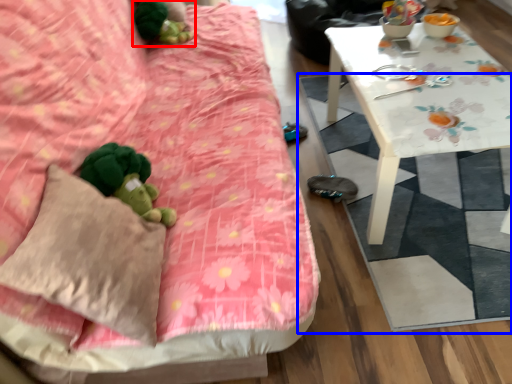
Question: Which point is closer to the camera, miniature (highlighted by a red box) or mat (highlighted by a blue box)?

Choices:
 (A) miniature
 (B) mat

Answer: (B)